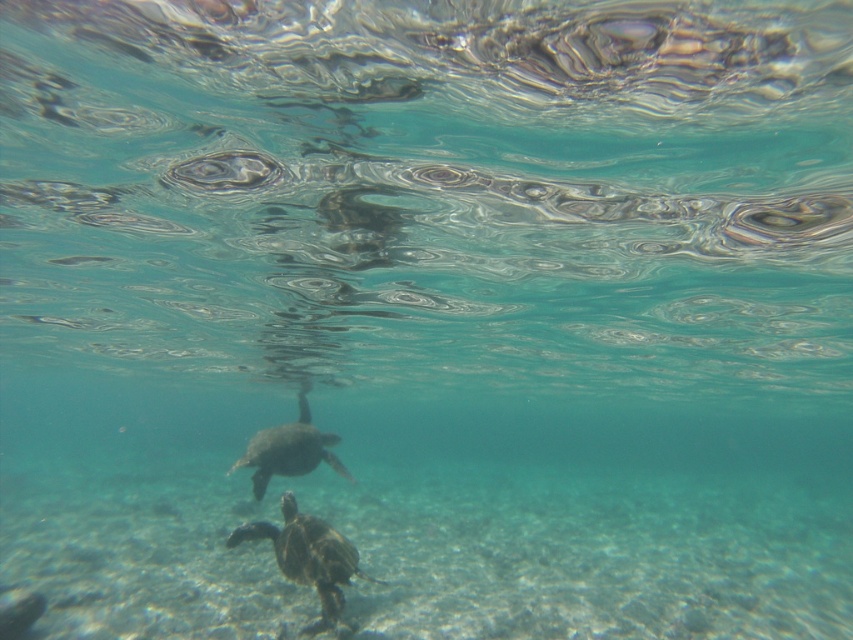
You are a marine biologist observing the underwater scene. You need to place a 5 meter long measuring tape between the green textured shell at center and the smooth gray turtle at center. Will the measuring tape reach both ends?

The distance between the green textured shell at center and the smooth gray turtle at center is 4.44 meters, so the 5 meter long measuring tape will reach both ends with some extra length remaining.

You are a marine biologist observing two points in the underwater scene. The points are labeled as point (274,536) and point (236,461). Based on their positions, which point is closer to the surface of the water?

Point (236,461) is closer to the surface of the water because it has a smaller y coordinate value, indicating it is positioned higher up in the image.